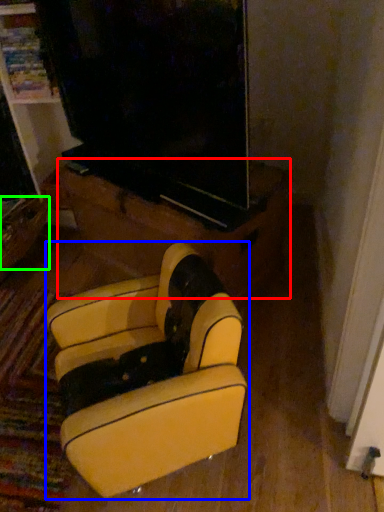
Question: Based on their relative distances, which object is farther from furniture (highlighted by a red box)? Choose from furniture (highlighted by a blue box) and drawer (highlighted by a green box).

Choices:
 (A) furniture
 (B) drawer

Answer: (B)